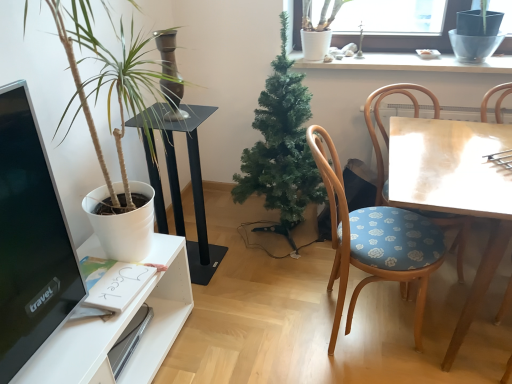
I want to click on vacant space underneath green artificial tree at center, which is counted as the 1th houseplant, starting from the right (from a real-world perspective), so click(x=281, y=246).